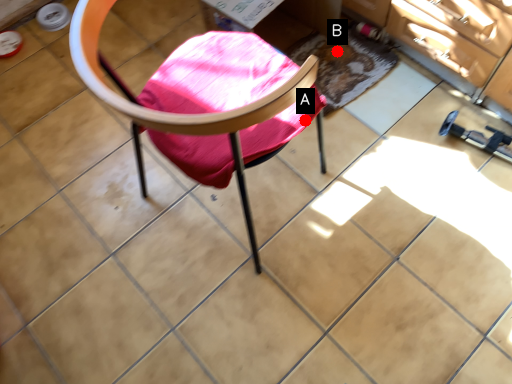
Question: Two points are circled on the image, labeled by A and B beside each circle. Which of the following is the farthest from the observer?

Choices:
 (A) A is further
 (B) B is further

Answer: (B)